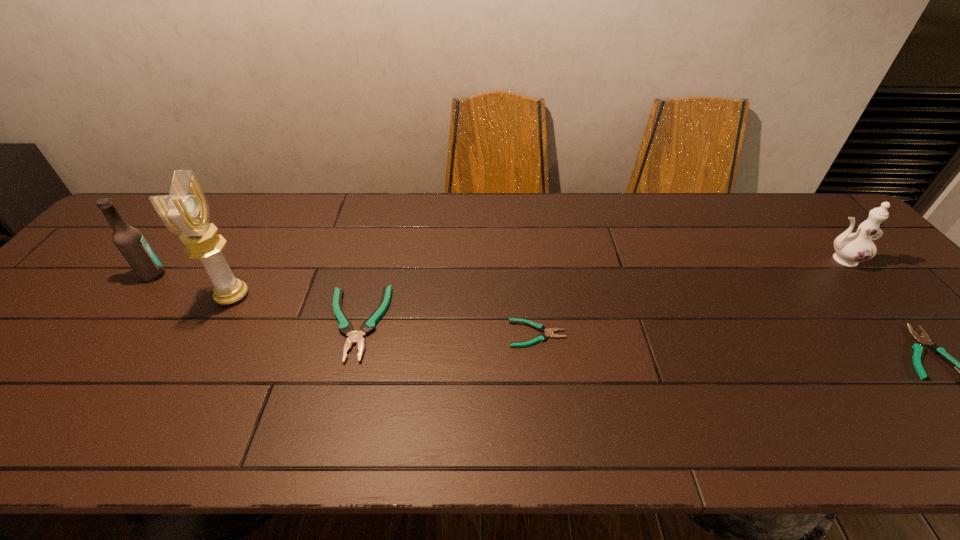
The image size is (960, 540). I want to click on the tallest pliers, so pyautogui.click(x=345, y=326).

I want to click on the leftmost pliers, so click(345, 326).

The image size is (960, 540). Find the location of `the fourth object from left to right`. the fourth object from left to right is located at coordinates (540, 327).

Identify the location of the shortest pliers. The width and height of the screenshot is (960, 540). (540, 327).

At what (x,y) coordinates should I click in order to perform the action: click on beer bottle. Please return your answer as a coordinate pair (x, y). The width and height of the screenshot is (960, 540). Looking at the image, I should click on (129, 240).

Find the location of a particular element. the second tallest object is located at coordinates (129, 240).

Locate an element on the screen. This screenshot has width=960, height=540. award is located at coordinates (185, 211).

Find the location of `the tallest object`. the tallest object is located at coordinates (185, 211).

I want to click on the third tallest object, so click(851, 248).

Identify the location of free space located 0.280m on the left of the third shortest object. The image size is (960, 540). (210, 323).